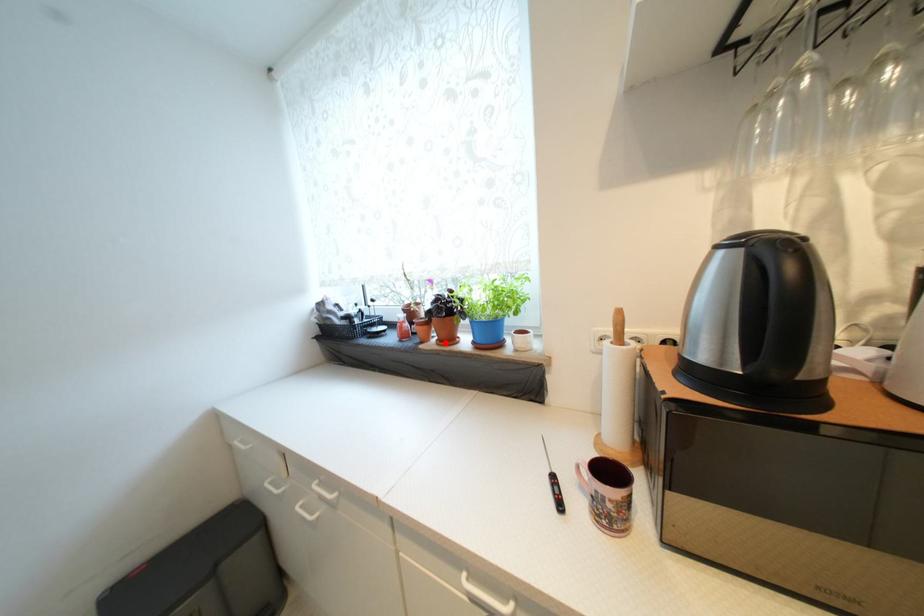
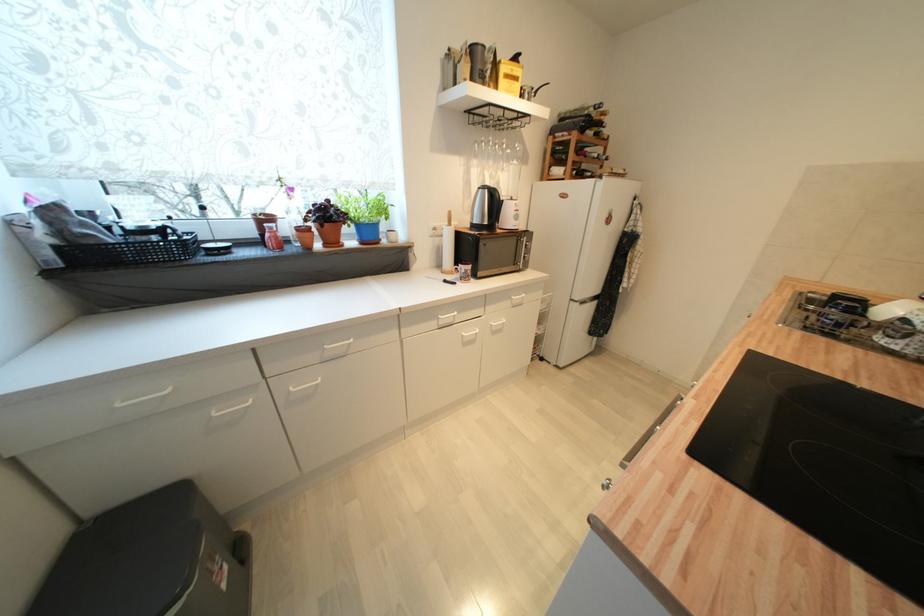
In the second image, find the point that corresponds to the highlighted location in the first image.

(331, 246)